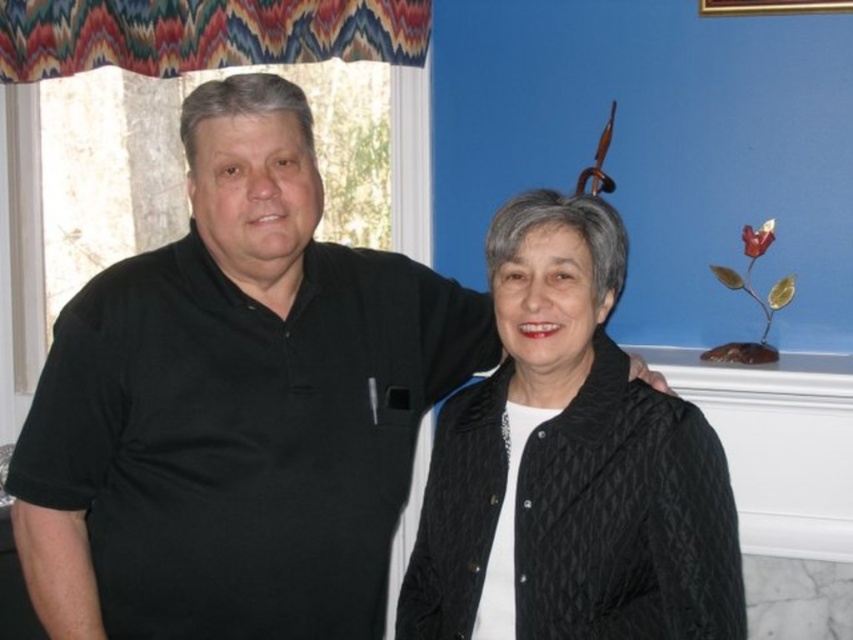
Question: Can you confirm if black matte shirt at left is bigger than gold wooden picture frame at upper right?

Choices:
 (A) yes
 (B) no

Answer: (A)

Question: Is black matte shirt at left below black quilted jacket at center?

Choices:
 (A) yes
 (B) no

Answer: (B)

Question: Which of these objects is positioned closest to the black quilted jacket at center?

Choices:
 (A) gold wooden picture frame at upper right
 (B) black matte shirt at left

Answer: (B)

Question: Which object appears closest to the camera in this image?

Choices:
 (A) gold wooden picture frame at upper right
 (B) black quilted jacket at center
 (C) black matte shirt at left

Answer: (B)

Question: Does black matte shirt at left lie behind gold wooden picture frame at upper right?

Choices:
 (A) no
 (B) yes

Answer: (A)

Question: Which is nearer to the gold wooden picture frame at upper right?

Choices:
 (A) black matte shirt at left
 (B) black quilted jacket at center

Answer: (B)